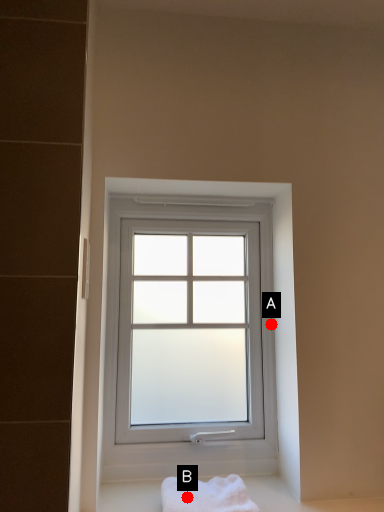
Question: Two points are circled on the image, labeled by A and B beside each circle. Which of the following is the farthest from the observer?

Choices:
 (A) A is further
 (B) B is further

Answer: (A)